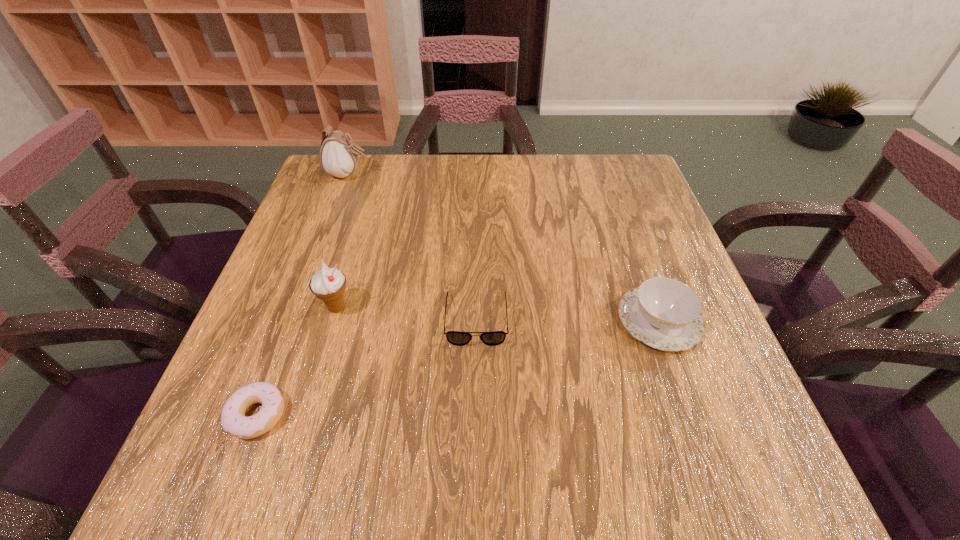
At what (x,y) coordinates should I click in order to perform the action: click on vacant region between the farthest object and the icecream. Please return your answer as a coordinate pair (x, y). The width and height of the screenshot is (960, 540). Looking at the image, I should click on (343, 241).

Where is `empty location between the pouch and the spectacles`? The height and width of the screenshot is (540, 960). empty location between the pouch and the spectacles is located at coordinates (413, 247).

This screenshot has height=540, width=960. I want to click on free area in between the farthest object and the icecream, so click(343, 241).

Locate an element on the screen. The height and width of the screenshot is (540, 960). vacant space in between the farthest object and the spectacles is located at coordinates (413, 247).

At what (x,y) coordinates should I click in order to perform the action: click on free space between the fourth object from left to right and the chinaware. Please return your answer as a coordinate pair (x, y). Looking at the image, I should click on click(568, 320).

At what (x,y) coordinates should I click in order to perform the action: click on vacant area that lies between the icecream and the nearest object. Please return your answer as a coordinate pair (x, y). Looking at the image, I should click on (297, 361).

Identify the location of free space that is in between the spectacles and the doughnut. The image size is (960, 540). (367, 367).

Locate an element on the screen. The height and width of the screenshot is (540, 960). unoccupied area between the second object from right to left and the farthest object is located at coordinates 413,247.

Identify which object is the third nearest to the rightmost object. Please provide its 2D coordinates. Your answer should be formatted as a tuple, i.e. [(x, y)], where the tuple contains the x and y coordinates of a point satisfying the conditions above.

[(233, 419)]

This screenshot has height=540, width=960. In order to click on the fourth closest object to the spectacles in this screenshot , I will do `click(339, 155)`.